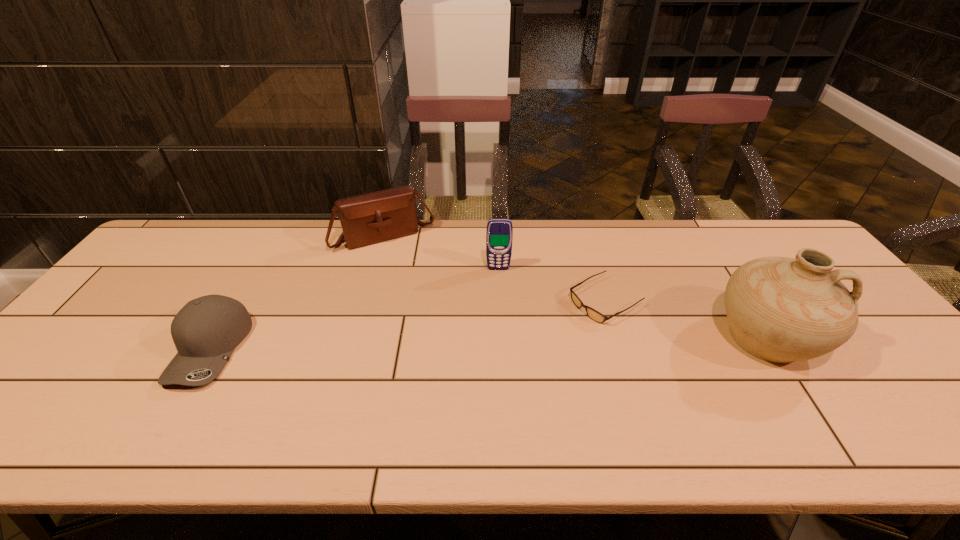
Image resolution: width=960 pixels, height=540 pixels. What are the coordinates of `object located in the far edge section of the desktop` in the screenshot? It's located at (370, 218).

The width and height of the screenshot is (960, 540). Find the location of `baseball cap that is positioned at the near edge`. baseball cap that is positioned at the near edge is located at coordinates 207,329.

The height and width of the screenshot is (540, 960). What are the coordinates of `pottery located at the near edge` in the screenshot? It's located at pos(779,309).

In the image, there is a desktop. Where is `free space at the far edge`? free space at the far edge is located at coordinates (398, 255).

The image size is (960, 540). Identify the location of free space at the near edge of the desktop. (317, 388).

In the image, there is a desktop. Where is `vacant region at the left edge`? This screenshot has width=960, height=540. vacant region at the left edge is located at coordinates (93, 357).

The width and height of the screenshot is (960, 540). I want to click on unoccupied area between the baseball cap and the shoulder bag, so click(x=298, y=293).

Where is `vacant point located between the shortest object and the third object from left to right`? The height and width of the screenshot is (540, 960). vacant point located between the shortest object and the third object from left to right is located at coordinates (552, 285).

Identify the location of empty space between the tallest object and the sunglasses. Image resolution: width=960 pixels, height=540 pixels. (686, 319).

At what (x,y) coordinates should I click in order to perform the action: click on free space that is in between the second farthest object and the shortest object. Please return your answer as a coordinate pair (x, y). The width and height of the screenshot is (960, 540). Looking at the image, I should click on (552, 285).